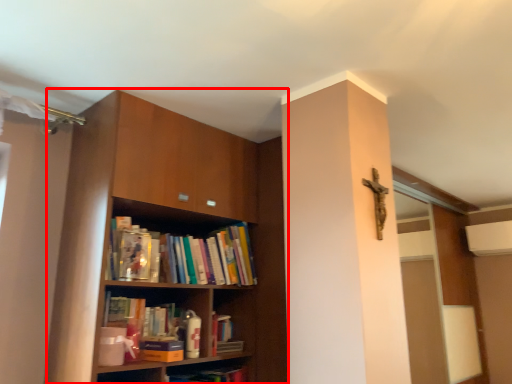
Question: Considering the relative positions of shelf (annotated by the red box) and paperback book in the image provided, where is shelf (annotated by the red box) located with respect to the staircase?

Choices:
 (A) left
 (B) right

Answer: (A)